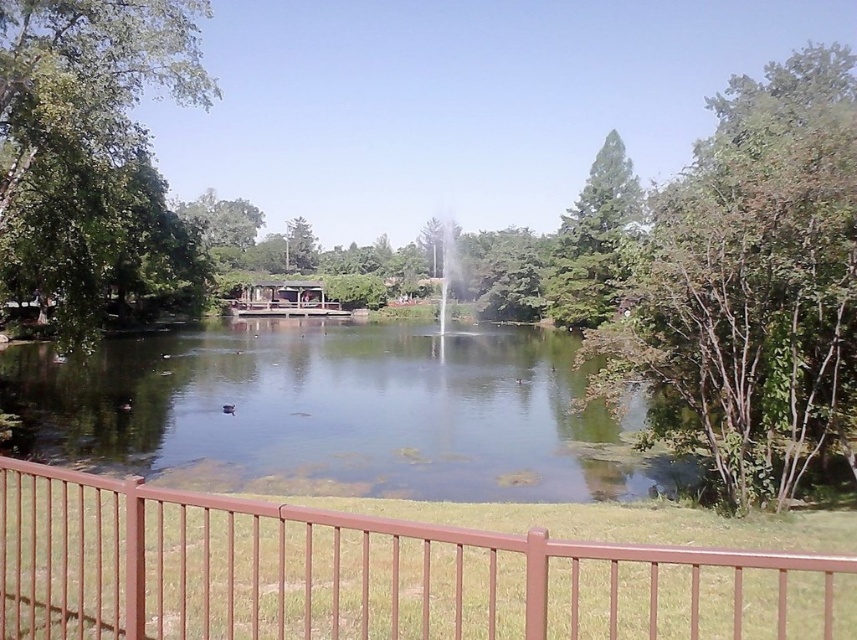
You are a visitor in the park and want to take a photo of the green leafy tree at right without the brown metal fence at lower center blocking the view. Where should you position yourself to achieve this?

To avoid the brown metal fence at lower center blocking the view of the green leafy tree at right, you should move to the right side of the brown metal fence at lower center so that the tree becomes visible without obstruction.

You are planning to take a photo of the wooden gazebo at center and the green leafy tree at right. Which object should you focus on first if you want to capture both in the same frame without moving the camera?

The green leafy tree at right is larger in size than the wooden gazebo at center, so you should focus on the green leafy tree at right first to ensure it fits properly in the frame.